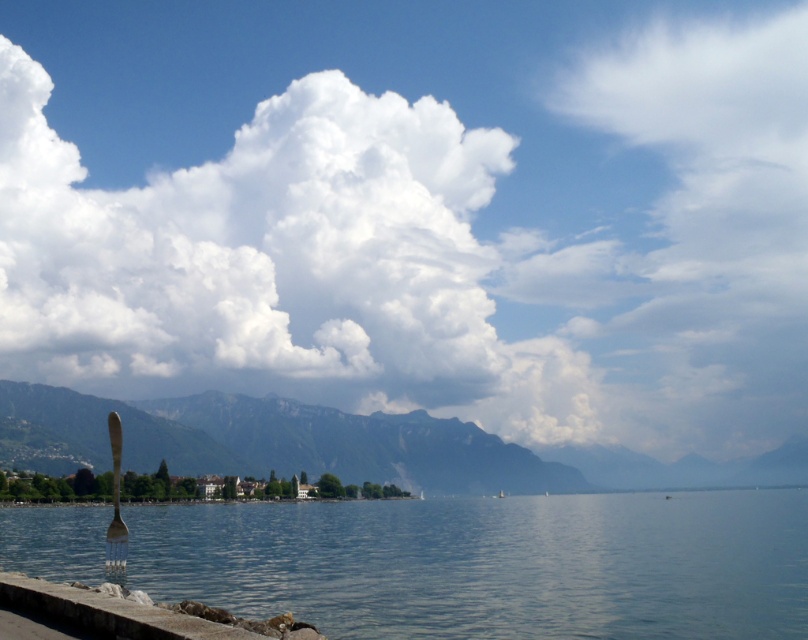
You are standing at the lakeside and see a point marked at coordinates point (415, 211). Based on the scene description, where is this point located?

The point (415, 211) is located on the white fluffy cloud at upper center.

You are standing at the lakeside and looking towards the mountains. There is a point marked at coordinates (415, 211). What object is located at that point?

The point at (415, 211) indicates a white fluffy cloud at upper center.

You are standing at the lakeside and want to take a photo of the white fluffy cloud at upper center and the gray stone ledge at lower left. Which object should you adjust your camera to focus on first if you want both in the frame?

You should focus on the gray stone ledge at lower left first because the white fluffy cloud at upper center is to the left of it, so adjusting the camera to include the gray stone ledge at lower left will naturally bring the white fluffy cloud at upper center into the frame as well.